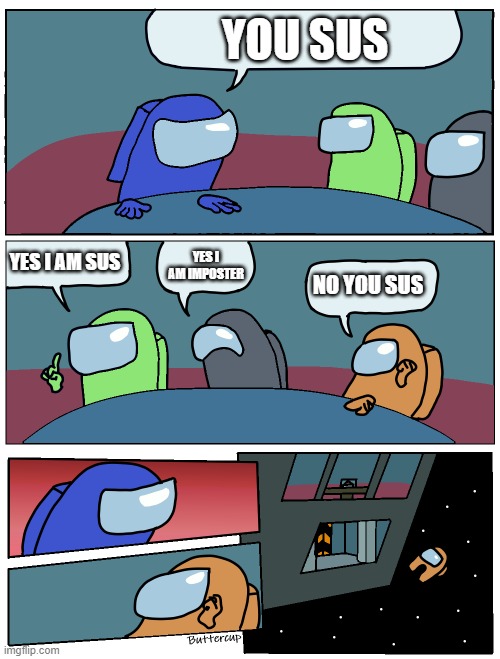
The width and height of the screenshot is (500, 659). In order to click on window in this screenshot , I will do `click(345, 544)`.